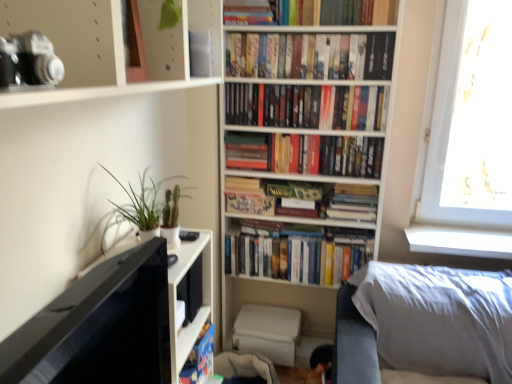
Question: Looking at their shapes, would you say hardcover book at center, placed as the 1th paperback book when sorted from left to right, is wider or thinner than matte black camera at upper left?

Choices:
 (A) wide
 (B) thin

Answer: (B)

Question: Looking at the image, does hardcover book at center, placed as the 1th paperback book when sorted from left to right, seem bigger or smaller compared to matte black camera at upper left?

Choices:
 (A) big
 (B) small

Answer: (B)

Question: Which is farther from the black matte camera at upper left?

Choices:
 (A) hardcover book at center, which is the 2th paperback book in left-to-right order
 (B) matte black camera at upper left
 (C) hardcover books at center, which ranks as the 3th book in bottom-to-top order
 (D) hardcover book at center, placed as the 1th paperback book when sorted from left to right
 (E) green matte plant at left

Answer: (A)

Question: Estimate the real-world distances between objects in this image. Which object is closer to the white soft pillow at lower right?

Choices:
 (A) hardcover books at upper center, the fifth book ordered from the bottom
 (B) hardcover books at center, which ranks as the first book in bottom-to-top order
 (C) hardcover book at center, placed as the 2th paperback book when sorted from right to left
 (D) black matte camera at upper left
 (E) hardcover book at center, arranged as the third paperback book when viewed from the right

Answer: (B)